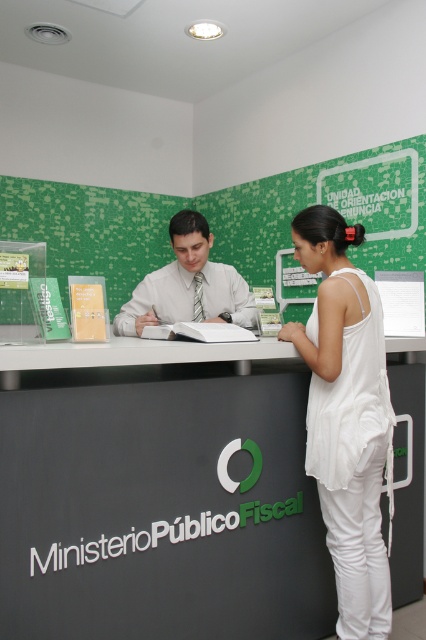
You are a visitor at the Ministerio P?blico Fiscal. You see a matte black desk at center and a white shirt at center. Which object is closer to you?

The matte black desk at center is closer to you since it is in front of the white shirt at center.

You are a visitor at the Ministerio P?blico Fiscal office. You see a point marked at coordinates [160,496]. What object is located at that point?

The point at coordinates 0.776, 0.376 indicates the location of the matte black desk at center.

You are standing at the entrance of the Ministerio Publico Fiscal office and need to approach the reception desk. There are two points marked on the floor as reference points. The first point is at coordinate point (155, 561) and the second is at coordinate point (350, 611). Which point should you step on first to reach the reception desk?

You should step on point (155, 561) first because it is in front of point (350, 611), meaning it is closer to the reception desk.